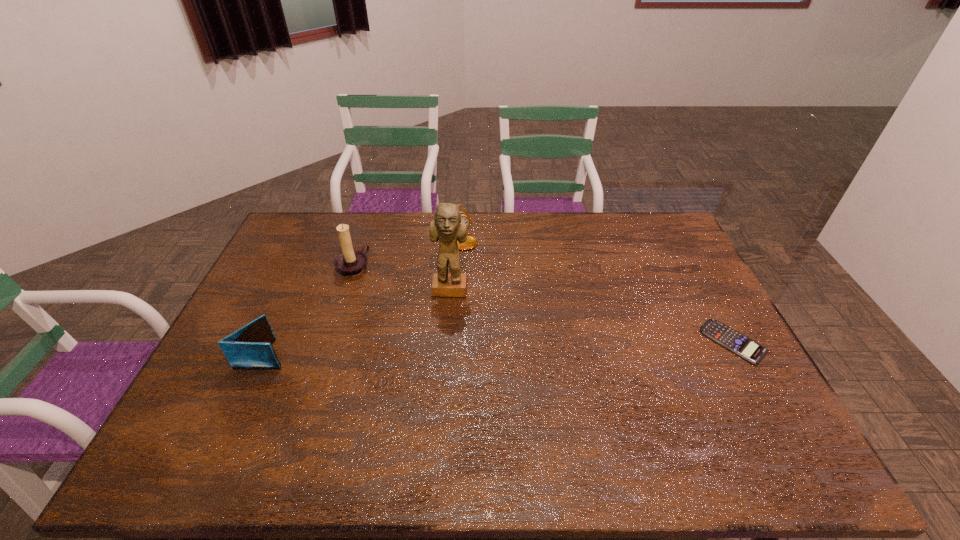
What are the coordinates of `vacant area situated on the exterior surface of the leftmost object` in the screenshot? It's located at (421, 354).

This screenshot has height=540, width=960. What are the coordinates of `vacant area located on the left of the calculator` in the screenshot? It's located at coord(681,342).

The image size is (960, 540). I want to click on blank space located 0.210m on the face of the pocket watch, so click(x=510, y=286).

I want to click on free region located 0.270m on the face of the pocket watch, so click(519, 298).

Identify the location of vacant position located on the face of the pocket watch. This screenshot has width=960, height=540. (510, 286).

Identify the location of vacant space situated 0.280m on the wick of the fourth nearest object. This screenshot has height=540, width=960. (433, 304).

Find the location of a particular element. The height and width of the screenshot is (540, 960). vacant space located on the wick of the fourth nearest object is located at coordinates (449, 311).

What are the coordinates of `vacant space situated 0.290m on the wick of the fourth nearest object` in the screenshot? It's located at (436, 305).

Identify the location of free spot located on the front-facing side of the third farthest object. (444, 379).

The width and height of the screenshot is (960, 540). I want to click on vacant position located on the front-facing side of the third farthest object, so click(444, 366).